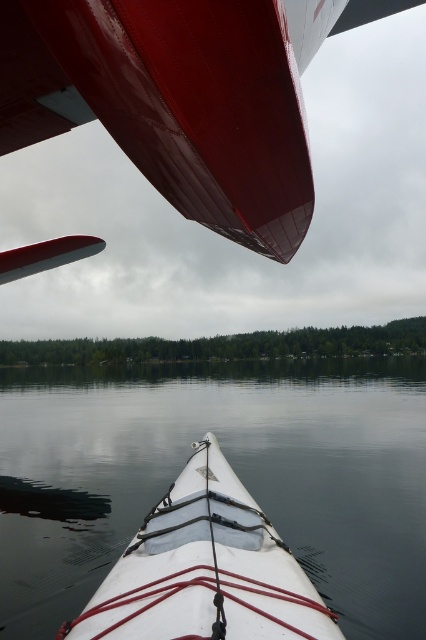
You are in a white matte kayak at center and see a glossy red airplane wing at upper left. Is the airplane wing above or below your kayak?

The glossy red airplane wing at upper left is located above the white matte kayak at center, so the airplane wing is above your kayak.

You are in a kayak and notice an airplane wing above you. Based on the scene, which object is shorter in length between the glossy red airplane wing at upper left and the white matte kayak at center?

The glossy red airplane wing at upper left is shorter than the white matte kayak at center according to the description.

You are in the white matte kayak at center and want to look up at the glossy red airplane wing at upper left. Can you see it clearly without moving your head?

The glossy red airplane wing at upper left is in front of the white matte kayak at center, so it will block your view. You need to move your head to see it.